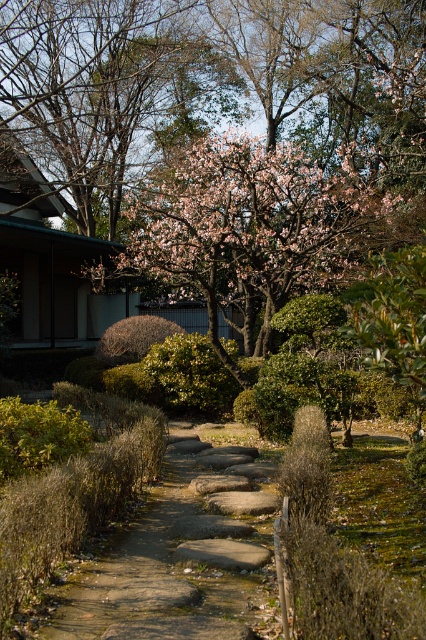
Question: Which point is farther to the camera?

Choices:
 (A) (143, 573)
 (B) (158, 362)
 (C) (164, 145)
 (D) (19, 416)

Answer: (C)

Question: Is pink blossoms at center to the right of green leafy bush at center from the viewer's perspective?

Choices:
 (A) yes
 (B) no

Answer: (A)

Question: Can you confirm if pink blossoms at center is bigger than green leafy bush at center?

Choices:
 (A) no
 (B) yes

Answer: (B)

Question: Does natural stone pathway at center have a greater width compared to green leafy bush at lower left?

Choices:
 (A) yes
 (B) no

Answer: (A)

Question: Which object is closer to the camera taking this photo?

Choices:
 (A) green leafy bush at center
 (B) green leafy bush at lower left

Answer: (B)

Question: Which object is the farthest from the pink blossoms at center?

Choices:
 (A) brown textured bush at center
 (B) green leafy bush at lower left
 (C) green leafy bush at center
 (D) pink blossom tree at upper center

Answer: (B)